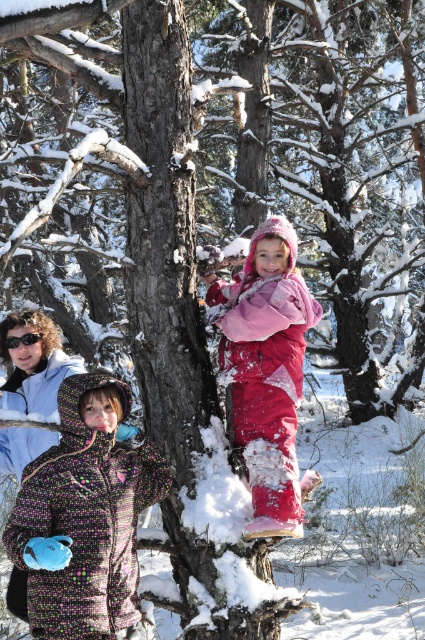
Question: Which point is closer to the camera taking this photo?

Choices:
 (A) (102, 621)
 (B) (8, 349)

Answer: (A)

Question: Can you confirm if multicolored fleece jacket at lower left is wider than fluffy pink snowsuit at center?

Choices:
 (A) yes
 (B) no

Answer: (A)

Question: Does fluffy pink snowsuit at center have a lesser width compared to black plastic goggles at upper left?

Choices:
 (A) no
 (B) yes

Answer: (A)

Question: Is multicolored fleece jacket at lower left to the left of fluffy pink snowsuit at center from the viewer's perspective?

Choices:
 (A) yes
 (B) no

Answer: (A)

Question: Which object is farther from the camera taking this photo?

Choices:
 (A) fluffy pink snowsuit at center
 (B) black plastic goggles at upper left
 (C) multicolored fleece jacket at lower left

Answer: (B)

Question: Considering the real-world distances, which object is farthest from the black plastic goggles at upper left?

Choices:
 (A) multicolored fleece jacket at lower left
 (B) fluffy pink snowsuit at center

Answer: (A)